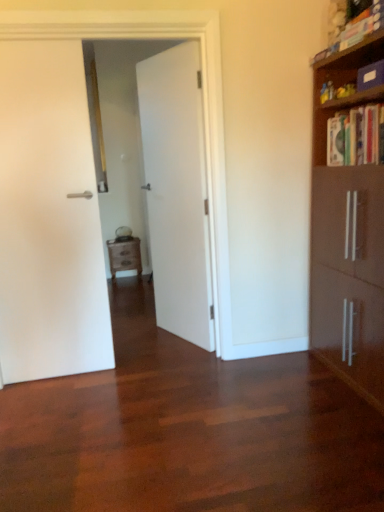
Find the location of a particular element. The image size is (384, 512). vacant area situated to the left side of white matte door at center, the 2th door positioned from the left is located at coordinates (148, 337).